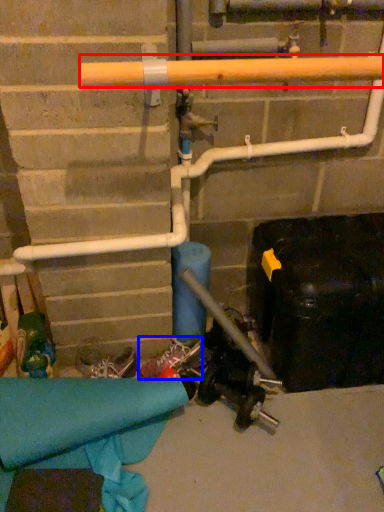
Question: Which object is further to the camera taking this photo, beam (highlighted by a red box) or footwear (highlighted by a blue box)?

Choices:
 (A) beam
 (B) footwear

Answer: (B)